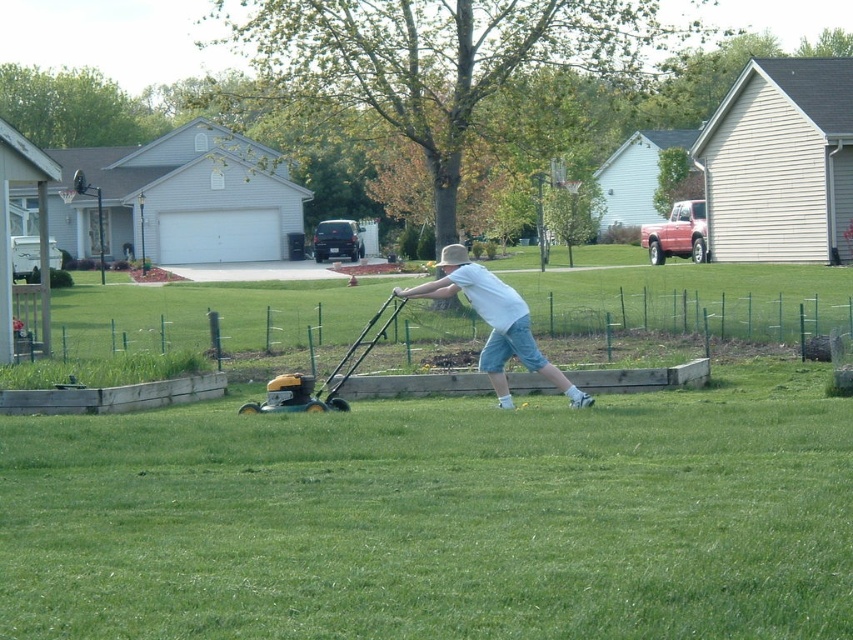
From the picture: Which of these two, green grass at center or white cotton shirt at center, stands shorter?

Standing shorter between the two is green grass at center.

Is green grass at center above white cotton shirt at center?

No, green grass at center is not above white cotton shirt at center.

Who is more distant from viewer, (567, 627) or (509, 324)?

Positioned behind is point (509, 324).

This screenshot has width=853, height=640. I want to click on green grass at center, so click(438, 518).